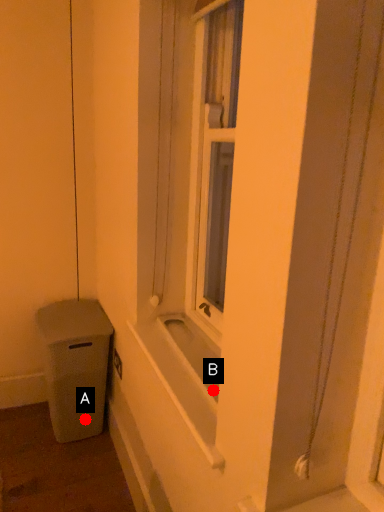
Question: Two points are circled on the image, labeled by A and B beside each circle. Which point is closer to the camera?

Choices:
 (A) A is closer
 (B) B is closer

Answer: (B)